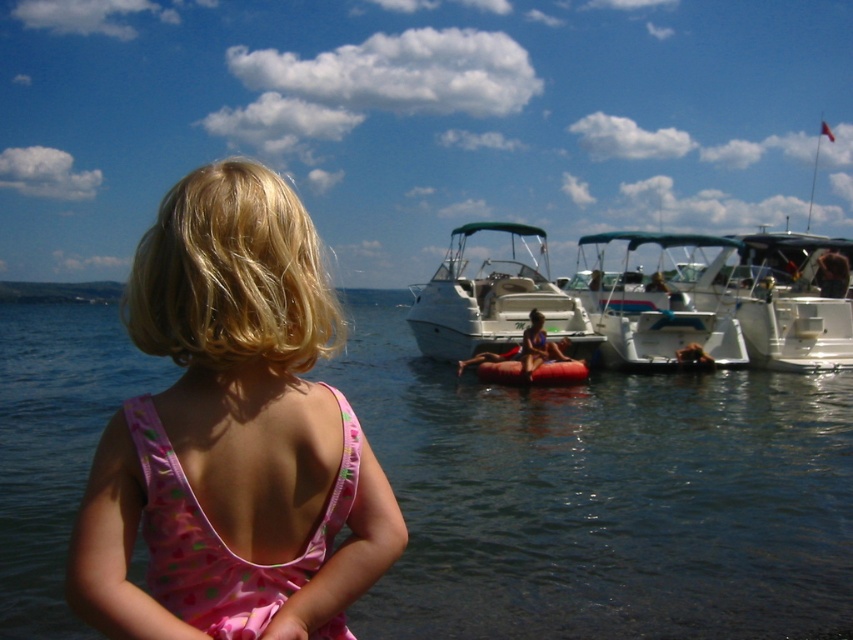
Does pink fabric dress at lower left have a lesser width compared to white plastic boat at center?

Correct, pink fabric dress at lower left's width is less than white plastic boat at center's.

The height and width of the screenshot is (640, 853). I want to click on pink fabric dress at lower left, so click(219, 538).

Is white glossy boat at center taller than rubber red raft at center?

Yes.

Who is more forward, (543, 264) or (547, 384)?

Point (547, 384) is in front.

Find the location of a particular element. This screenshot has width=853, height=640. white glossy boat at center is located at coordinates (494, 300).

Which is in front, point (454, 340) or point (523, 368)?

Positioned in front is point (523, 368).

Is point (463, 333) in front of point (531, 358)?

No, (463, 333) is behind (531, 358).

Is point (451, 275) more distant than point (534, 316)?

Yes, it is.

Locate an element on the screen. white glossy boat at center is located at coordinates (494, 300).